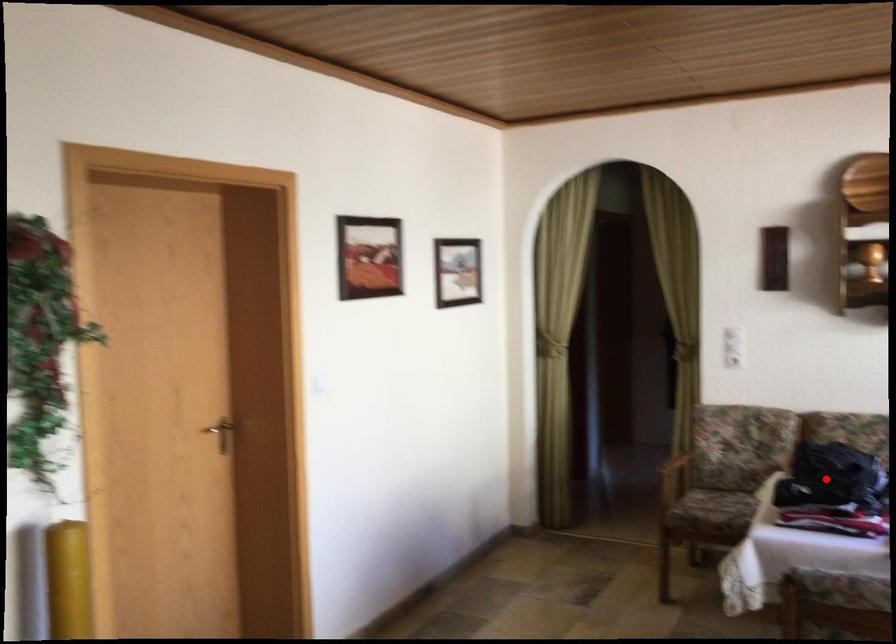
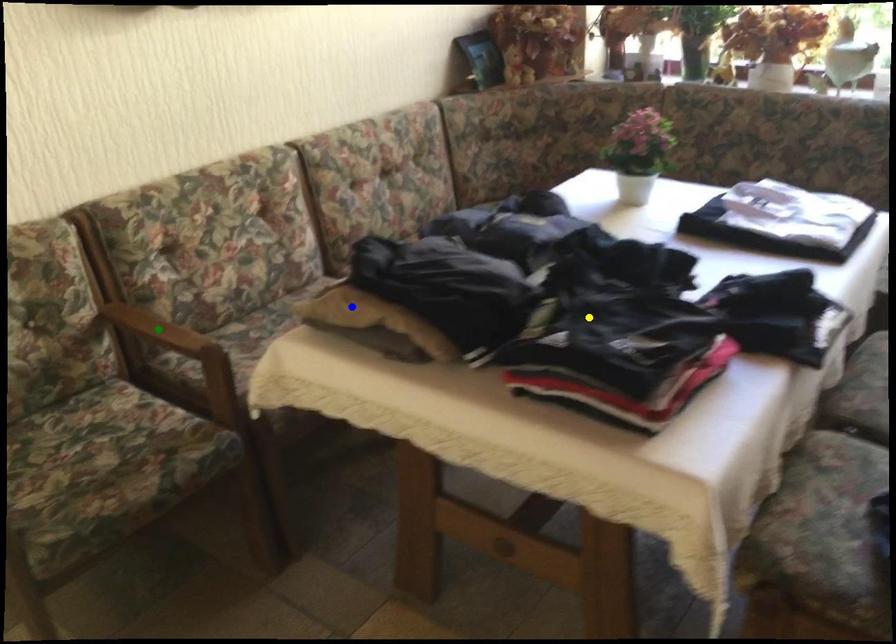
Question: I am providing you with two images of the same scene from different viewpoints. A red point is marked on the first image. You are given multiple points on the second image. Which point in image 2 is actually the same real-world point as the red point in image 1?

Choices:
 (A) yellow point
 (B) green point
 (C) blue point

Answer: (A)